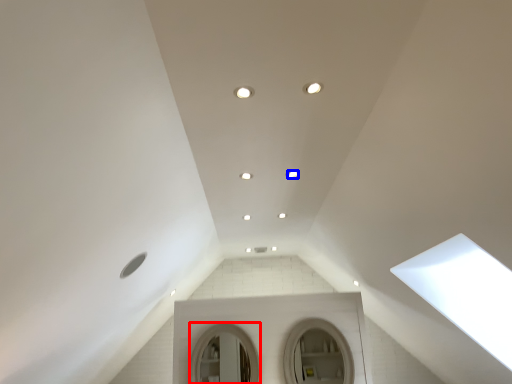
Question: Which object is further to the camera taking this photo, mirror (highlighted by a red box) or lighting (highlighted by a blue box)?

Choices:
 (A) mirror
 (B) lighting

Answer: (A)